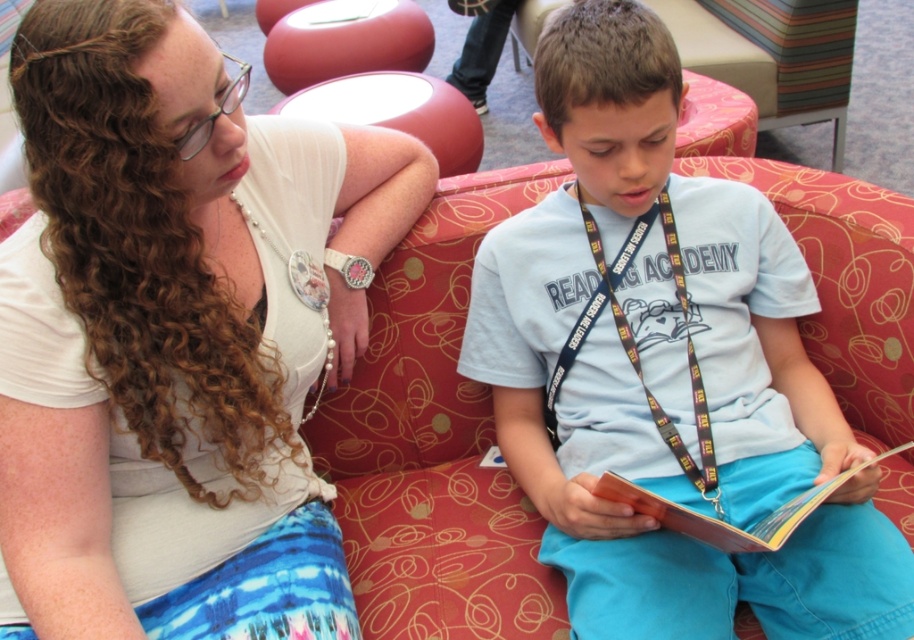
Can you confirm if black fabric lanyard at center is smaller than hardcover book at center?

Actually, black fabric lanyard at center might be larger than hardcover book at center.

Does black fabric lanyard at center have a greater width compared to hardcover book at center?

In fact, black fabric lanyard at center might be narrower than hardcover book at center.

The image size is (914, 640). I want to click on black fabric lanyard at center, so click(636, 342).

This screenshot has height=640, width=914. I want to click on black fabric lanyard at center, so click(636, 342).

Can you confirm if white matte tank top at upper left is positioned to the left of black fabric lanyard at center?

Indeed, white matte tank top at upper left is positioned on the left side of black fabric lanyard at center.

Between white matte tank top at upper left and black fabric lanyard at center, which one appears on the right side from the viewer's perspective?

From the viewer's perspective, black fabric lanyard at center appears more on the right side.

This screenshot has width=914, height=640. Describe the element at coordinates (177, 333) in the screenshot. I see `white matte tank top at upper left` at that location.

Where is `white matte tank top at upper left`? white matte tank top at upper left is located at coordinates (177, 333).

Does light blue cotton shirt at center come in front of hardcover book at center?

No, light blue cotton shirt at center is behind hardcover book at center.

Who is positioned more to the right, light blue cotton shirt at center or hardcover book at center?

Positioned to the right is hardcover book at center.

Describe the element at coordinates (668, 369) in the screenshot. I see `light blue cotton shirt at center` at that location.

The width and height of the screenshot is (914, 640). Identify the location of light blue cotton shirt at center. (668, 369).